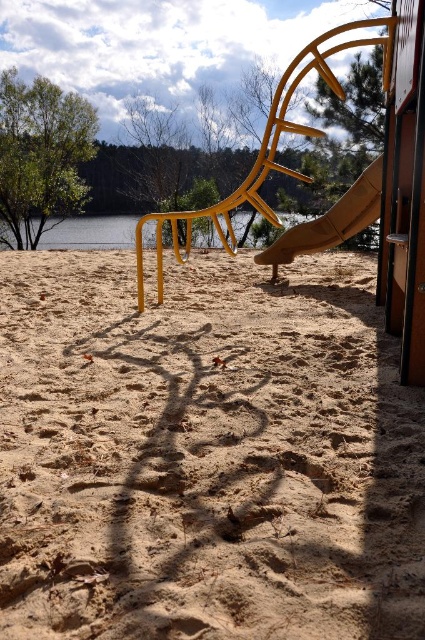
Question: Which object is positioned closest to the green leafy tree at left?

Choices:
 (A) matte yellow slide at center
 (B) transparent water at center

Answer: (B)

Question: Does brown sandy ground at center have a greater width compared to transparent water at center?

Choices:
 (A) no
 (B) yes

Answer: (A)

Question: Which point is closer to the camera?

Choices:
 (A) (379, 211)
 (B) (70, 486)
 (C) (93, 232)

Answer: (B)

Question: Is brown sandy ground at center closer to camera compared to green leafy tree at left?

Choices:
 (A) no
 (B) yes

Answer: (B)

Question: Among these points, which one is nearest to the camera?

Choices:
 (A) (235, 218)
 (B) (70, 144)
 (C) (33, 307)

Answer: (C)

Question: In this image, where is brown sandy ground at center located relative to green leafy tree at left?

Choices:
 (A) above
 (B) below

Answer: (B)